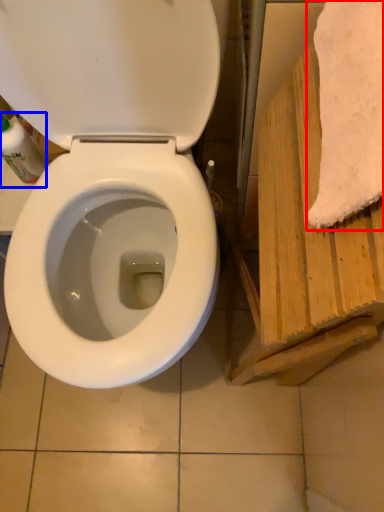
Question: Which object appears closest to the camera in this image, bath towel (highlighted by a red box) or cleaning product (highlighted by a blue box)?

Choices:
 (A) bath towel
 (B) cleaning product

Answer: (A)